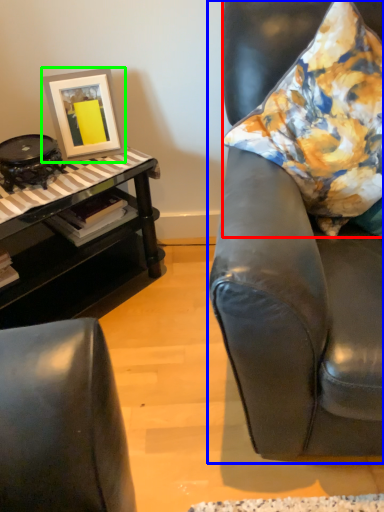
Question: Which object is the closest to the pillow (highlighted by a red box)? Choose among these: chair (highlighted by a blue box) or picture frame (highlighted by a green box).

Choices:
 (A) chair
 (B) picture frame

Answer: (A)